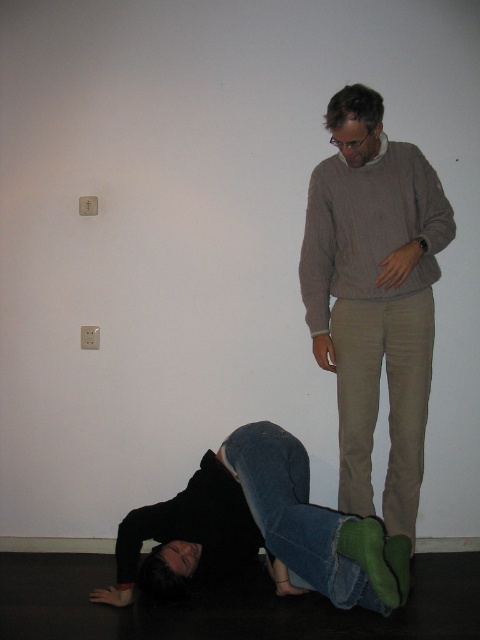
Question: Which point is farther from the camera taking this photo?

Choices:
 (A) (361, 518)
 (B) (420, 172)
 (C) (381, 291)

Answer: (C)

Question: Does cable-knit sweater at center lie in front of jeans at lower center?

Choices:
 (A) yes
 (B) no

Answer: (B)

Question: Which point is farther to the camera?

Choices:
 (A) cable-knit sweater at center
 (B) light brown sweater at center
 (C) jeans at lower center

Answer: (A)

Question: Which of these objects is positioned farthest from the cable-knit sweater at center?

Choices:
 (A) jeans at lower center
 (B) light brown sweater at center

Answer: (A)

Question: Can you confirm if light brown sweater at center is positioned above jeans at lower center?

Choices:
 (A) yes
 (B) no

Answer: (A)

Question: From the image, what is the correct spatial relationship of light brown sweater at center in relation to cable-knit sweater at center?

Choices:
 (A) left
 (B) right

Answer: (B)